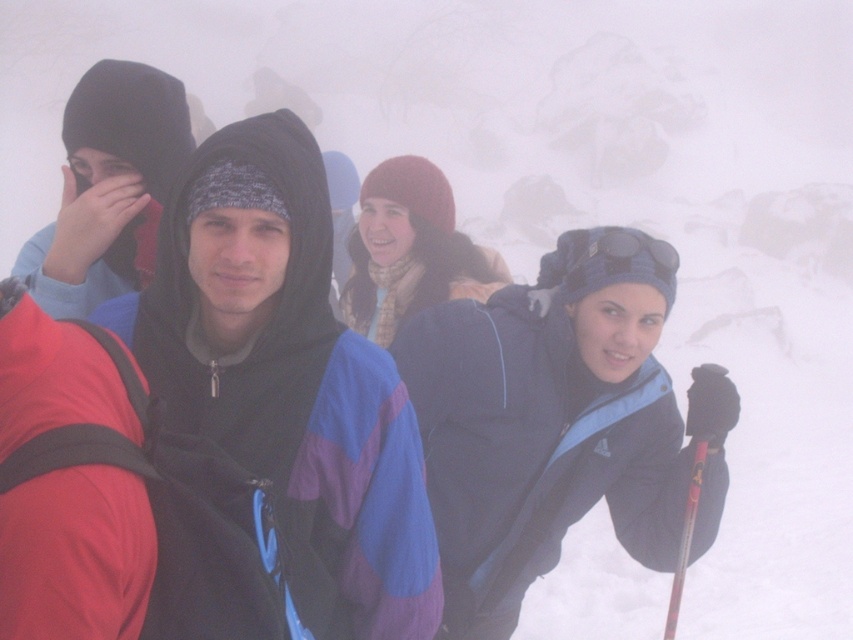
Can you confirm if blue fleece jacket at center is bigger than red plastic ski pole at lower right?

Correct, blue fleece jacket at center is larger in size than red plastic ski pole at lower right.

Who is more forward, (625, 365) or (691, 496)?

Point (691, 496)

Who is more forward, (608, 241) or (698, 476)?

Point (608, 241) is more forward.

Identify the location of blue fleece jacket at center. (547, 420).

Is point (108, 147) more distant than point (689, 480)?

No, (108, 147) is closer to viewer.

Is matte black hoodie at left above red plastic ski pole at lower right?

Yes, matte black hoodie at left is above red plastic ski pole at lower right.

Where is `matte black hoodie at left`? This screenshot has height=640, width=853. matte black hoodie at left is located at coordinates (108, 188).

Where is `matte black hoodie at left`? Image resolution: width=853 pixels, height=640 pixels. matte black hoodie at left is located at coordinates (108, 188).

Does blue fleece jacket at center have a smaller size compared to matte black hoodie at left?

Actually, blue fleece jacket at center might be larger than matte black hoodie at left.

Does point (572, 339) lie in front of point (97, 138)?

No, it is behind (97, 138).

Which is in front, point (709, 474) or point (45, 291)?

Point (45, 291)

At what (x,y) coordinates should I click in order to perform the action: click on blue fleece jacket at center. Please return your answer as a coordinate pair (x, y). This screenshot has width=853, height=640. Looking at the image, I should click on (547, 420).